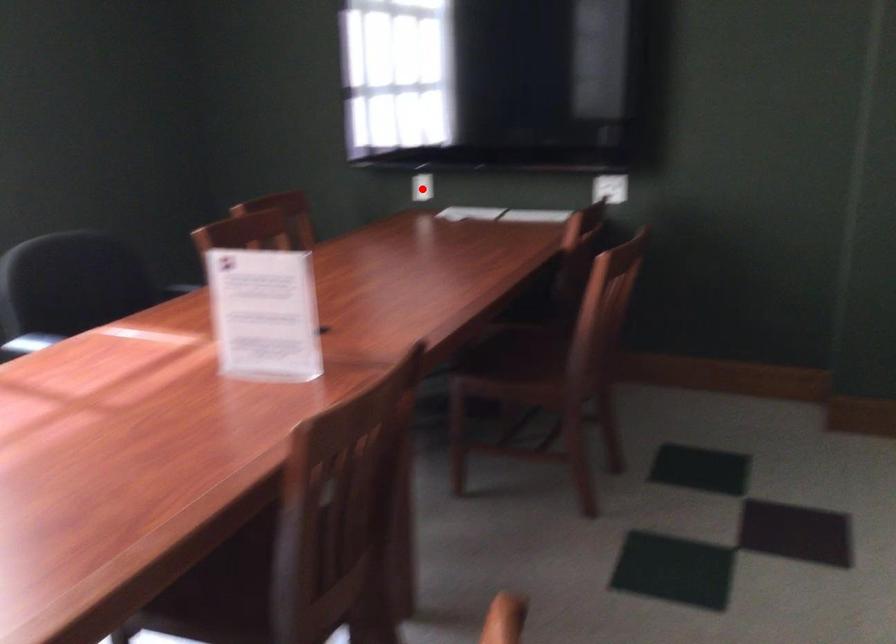
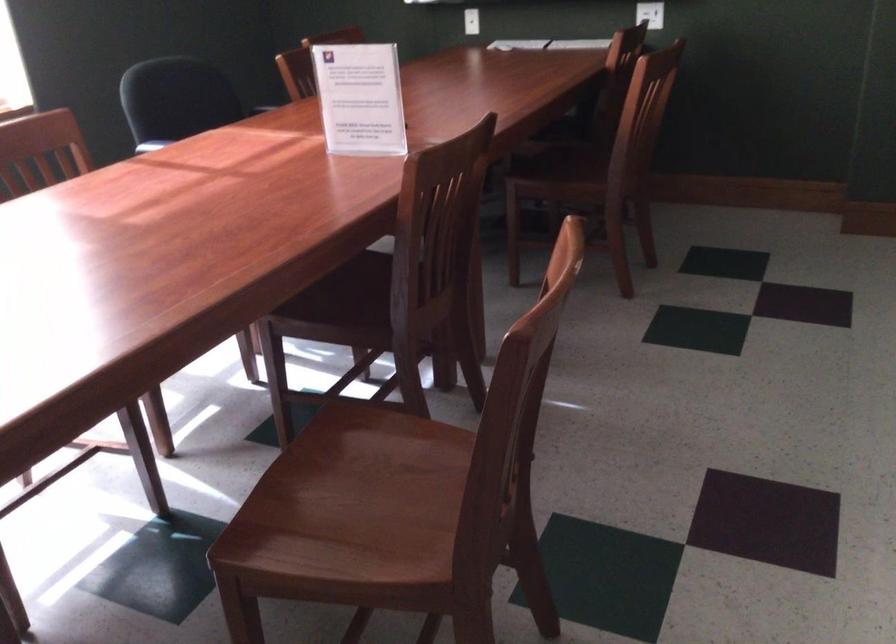
The point at the highlighted location is marked in the first image. Where is the corresponding point in the second image?

(471, 21)